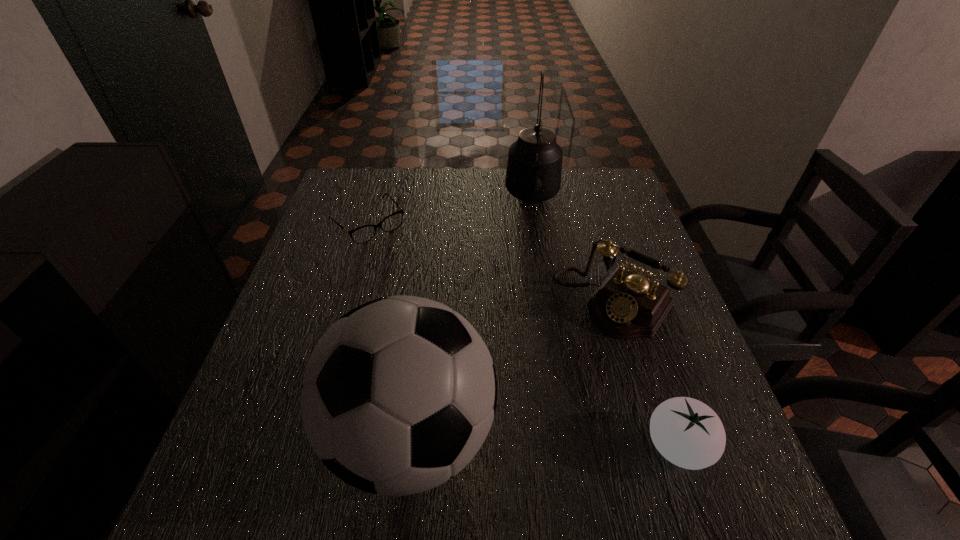
Find the location of a particular element. The height and width of the screenshot is (540, 960). the fourth shortest object is located at coordinates (398, 396).

Locate an element on the screen. This screenshot has width=960, height=540. tomato is located at coordinates (688, 433).

Find the location of a particular element. This screenshot has width=960, height=540. telephone is located at coordinates (627, 305).

At what (x,y) coordinates should I click in order to perform the action: click on the third tallest object. Please return your answer as a coordinate pair (x, y). Looking at the image, I should click on (627, 305).

I want to click on kettle, so click(x=534, y=167).

The width and height of the screenshot is (960, 540). What are the coordinates of `the shortest object` in the screenshot? It's located at 363,234.

The image size is (960, 540). What are the coordinates of `blank area located on the right of the second tallest object` in the screenshot? It's located at (556, 436).

Locate an element on the screen. free location located 0.330m on the left of the second shortest object is located at coordinates (459, 446).

Find the location of a particular element. This screenshot has width=960, height=540. vacant space situated on the dial of the third farthest object is located at coordinates (526, 404).

Locate an element on the screen. vacant region located 0.110m on the dial of the third farthest object is located at coordinates [559, 363].